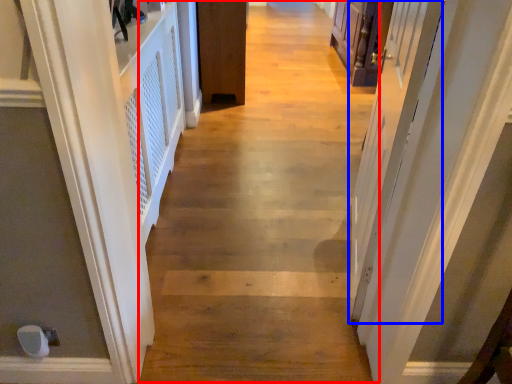
Question: Which object appears farthest to the camera in this image, path (highlighted by a red box) or screen door (highlighted by a blue box)?

Choices:
 (A) path
 (B) screen door

Answer: (A)